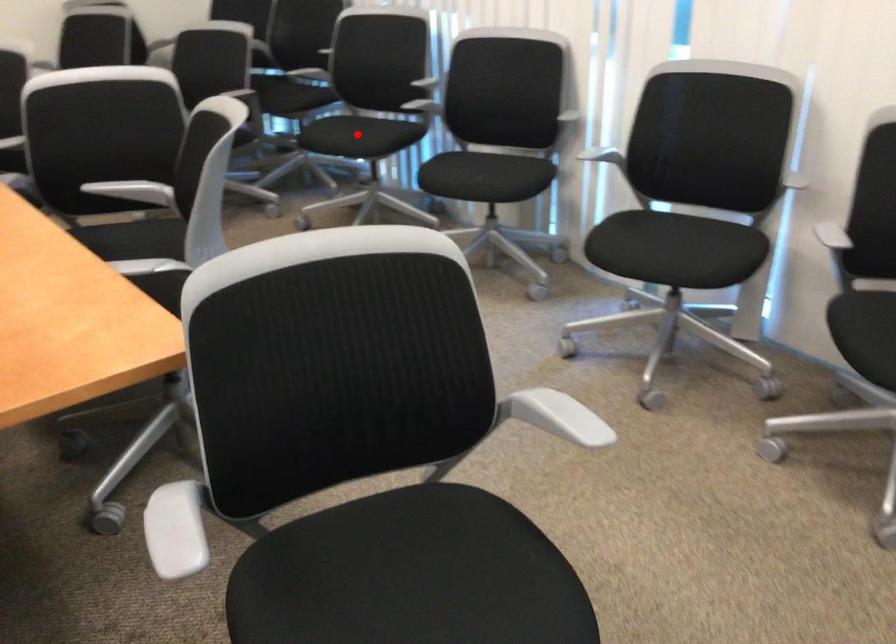
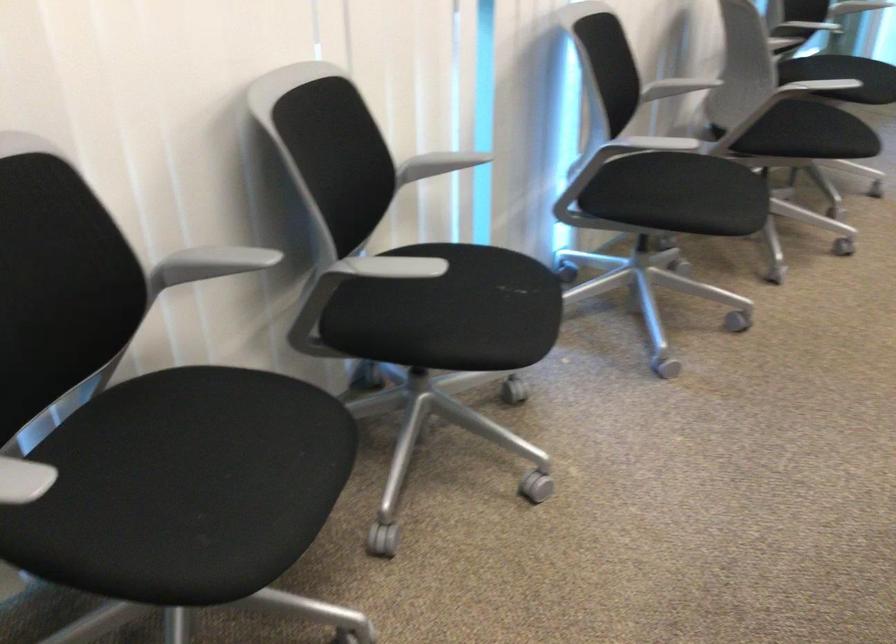
The point at the highlighted location is marked in the first image. Where is the corresponding point in the second image?

(226, 456)